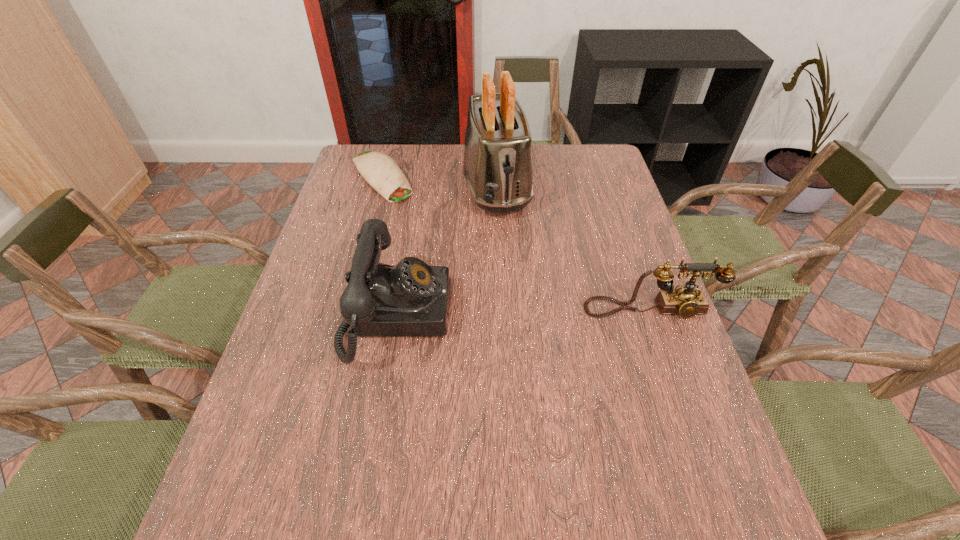
Locate an element on the screen. This screenshot has height=540, width=960. object at the far left corner is located at coordinates (378, 169).

Where is `free space at the far edge of the desktop`? free space at the far edge of the desktop is located at coordinates (553, 150).

Find the location of `vacant space at the near edge of the desktop`. vacant space at the near edge of the desktop is located at coordinates (570, 462).

In the image, there is a desktop. Where is `vacant space at the left edge`? vacant space at the left edge is located at coordinates (312, 315).

The image size is (960, 540). I want to click on free space at the right edge, so click(x=639, y=388).

In the image, there is a desktop. Where is `free space at the far right corner`? Image resolution: width=960 pixels, height=540 pixels. free space at the far right corner is located at coordinates (596, 181).

Locate an element on the screen. The height and width of the screenshot is (540, 960). free spot between the third tallest object and the toaster is located at coordinates (573, 248).

Locate an element on the screen. This screenshot has height=540, width=960. free spot between the toaster and the left telephone is located at coordinates (446, 251).

Find the location of `empty space between the shorter telephone and the burrito`. empty space between the shorter telephone and the burrito is located at coordinates (516, 244).

This screenshot has height=540, width=960. Identify the location of vacant space that is in between the shortest object and the tallest object. (439, 181).